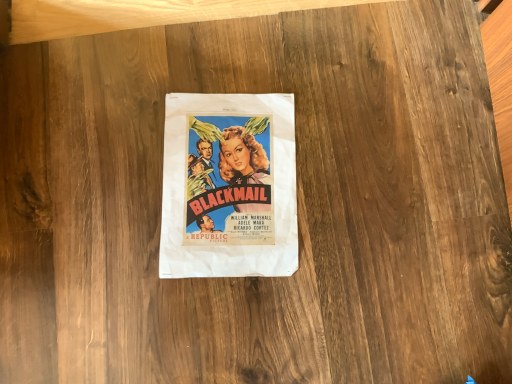
This screenshot has height=384, width=512. What are the coordinates of `vacant space situated above white paper poster at center (from a real-world perspective)` in the screenshot? It's located at (233, 187).